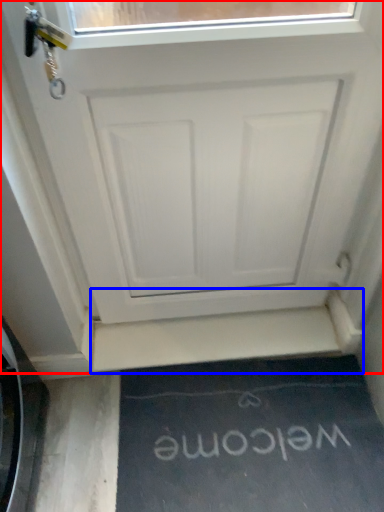
Question: Which object appears closest to the camera in this image, door (highlighted by a red box) or stairwell (highlighted by a blue box)?

Choices:
 (A) door
 (B) stairwell

Answer: (A)